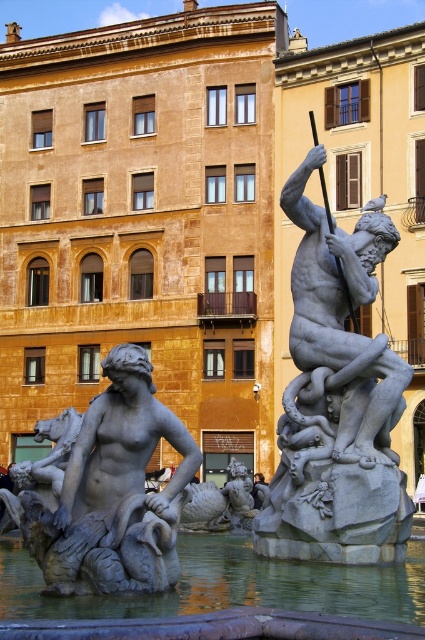
Based on the scene description, can you determine the spatial relationship between the gray stone statue at center and the clear water at center?

The gray stone statue at center is positioned over clear water at center, meaning the statue is above the water.

You are standing at the edge of the fountain and want to pour some coins into the clear water at center. The matte gray statue at center is in your way. Can you walk around it to reach the water?

The matte gray statue at center is 8.28 feet away from clear water at center. Since the statue is only 8.28 feet away from the water, you can easily walk around it to reach the clear water at center.